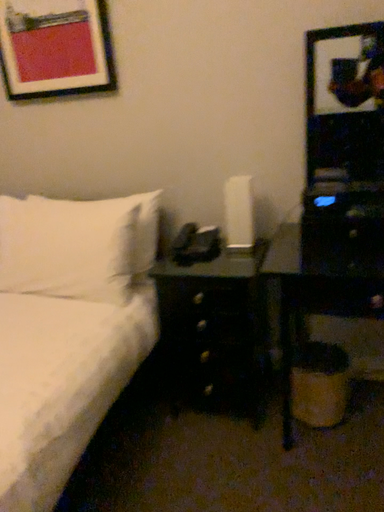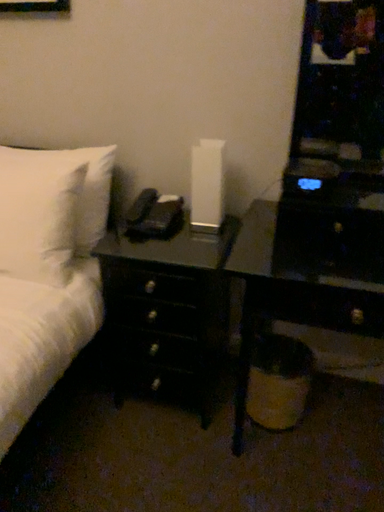
Question: How did the camera likely rotate when shooting the video?

Choices:
 (A) rotated upward
 (B) rotated downward

Answer: (B)